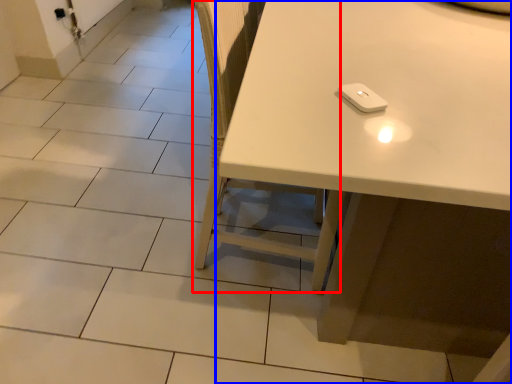
Question: Among these objects, which one is nearest to the camera, chair (highlighted by a red box) or table (highlighted by a blue box)?

Choices:
 (A) chair
 (B) table

Answer: (B)